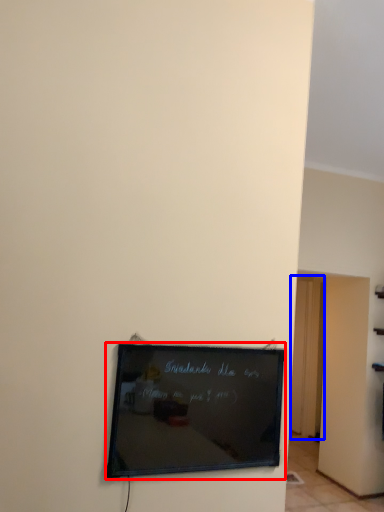
Question: Among these objects, which one is nearest to the camera, picture frame (highlighted by a red box) or door (highlighted by a blue box)?

Choices:
 (A) picture frame
 (B) door

Answer: (A)